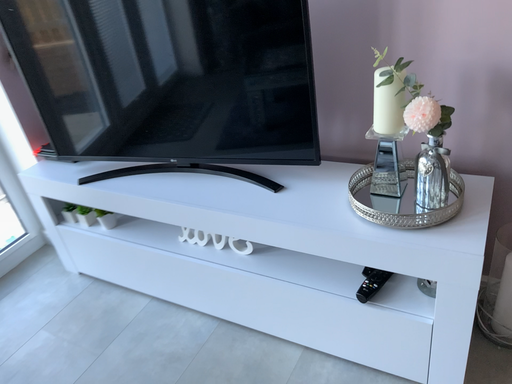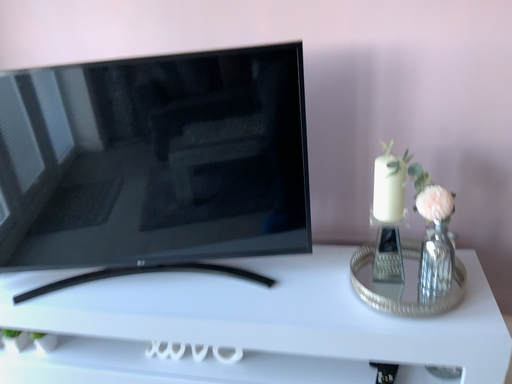
Question: How did the camera likely rotate when shooting the video?

Choices:
 (A) rotated downward
 (B) rotated upward

Answer: (B)